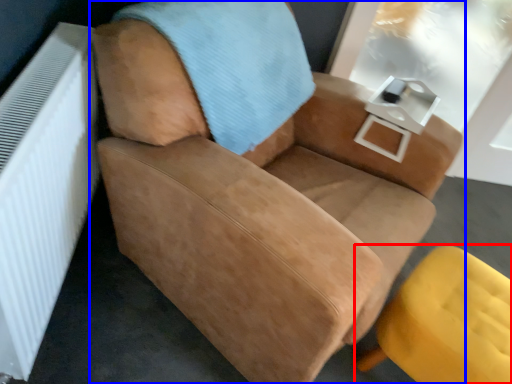
Question: Which point is further to the camera, chair (highlighted by a red box) or chair (highlighted by a blue box)?

Choices:
 (A) chair
 (B) chair

Answer: (A)